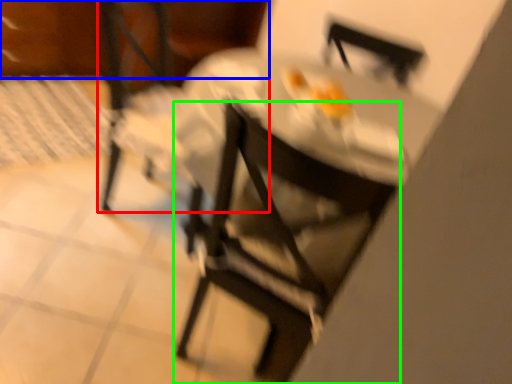
Question: Based on their relative distances, which object is farther from chair (highlighted by a red box)? Choose from leftover (highlighted by a blue box) and chair (highlighted by a green box).

Choices:
 (A) leftover
 (B) chair

Answer: (B)